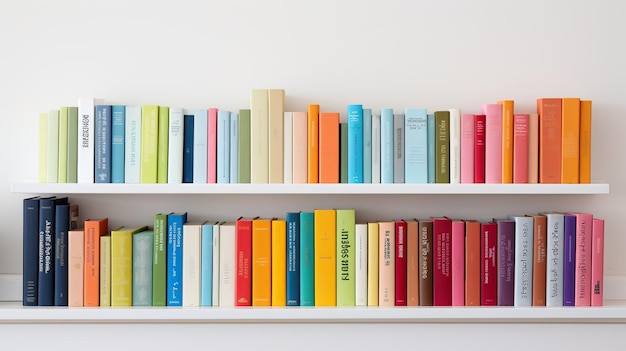
I want to click on white books, so click(227, 267), click(217, 272), click(188, 267), click(180, 167), click(85, 155), click(454, 136).